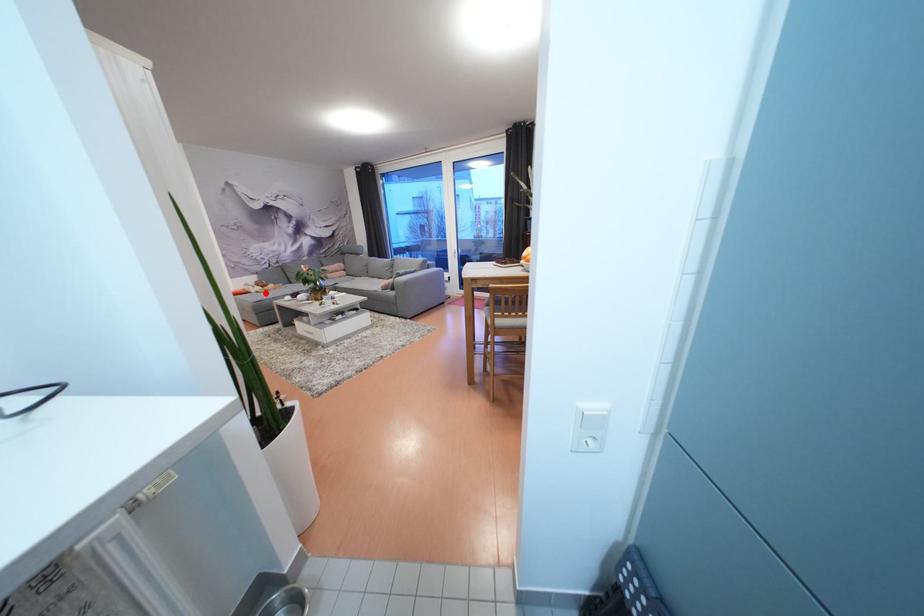
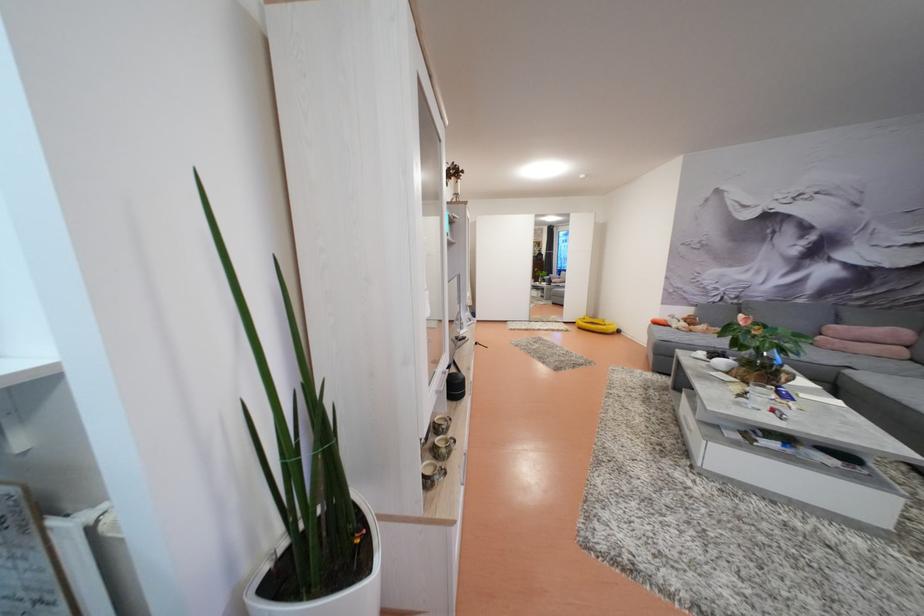
Locate, in the second image, the point that corresponds to the highlighted location in the first image.

(689, 330)